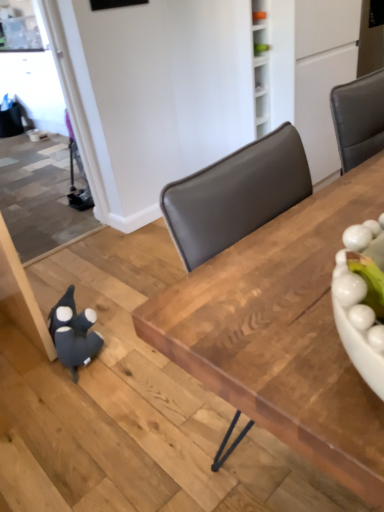
Question: Is velvety dark blue plush toy at lower left wider than wooden table at center?

Choices:
 (A) no
 (B) yes

Answer: (A)

Question: Considering the relative positions of velvety dark blue plush toy at lower left and wooden table at center in the image provided, is velvety dark blue plush toy at lower left to the left of wooden table at center from the viewer's perspective?

Choices:
 (A) no
 (B) yes

Answer: (B)

Question: Is velvety dark blue plush toy at lower left next to wooden table at center and touching it?

Choices:
 (A) no
 (B) yes

Answer: (A)

Question: Does velvety dark blue plush toy at lower left have a lesser height compared to wooden table at center?

Choices:
 (A) yes
 (B) no

Answer: (A)

Question: Is velvety dark blue plush toy at lower left not inside wooden table at center?

Choices:
 (A) no
 (B) yes

Answer: (B)

Question: Is velvety dark blue plush toy at lower left closer to camera compared to wooden table at center?

Choices:
 (A) no
 (B) yes

Answer: (A)

Question: Is wooden table at center turned away from velvety dark blue plush toy at lower left?

Choices:
 (A) no
 (B) yes

Answer: (B)

Question: From the image's perspective, is wooden table at center on top of velvety dark blue plush toy at lower left?

Choices:
 (A) yes
 (B) no

Answer: (A)

Question: From the image's perspective, does wooden table at center appear lower than velvety dark blue plush toy at lower left?

Choices:
 (A) no
 (B) yes

Answer: (A)

Question: Would you say wooden table at center is outside velvety dark blue plush toy at lower left?

Choices:
 (A) no
 (B) yes

Answer: (B)

Question: Does wooden table at center lie in front of velvety dark blue plush toy at lower left?

Choices:
 (A) no
 (B) yes

Answer: (B)

Question: Considering the relative sizes of wooden table at center and velvety dark blue plush toy at lower left in the image provided, is wooden table at center bigger than velvety dark blue plush toy at lower left?

Choices:
 (A) yes
 (B) no

Answer: (A)

Question: Looking at the image, does velvety dark blue plush toy at lower left seem bigger or smaller compared to wooden table at center?

Choices:
 (A) big
 (B) small

Answer: (B)